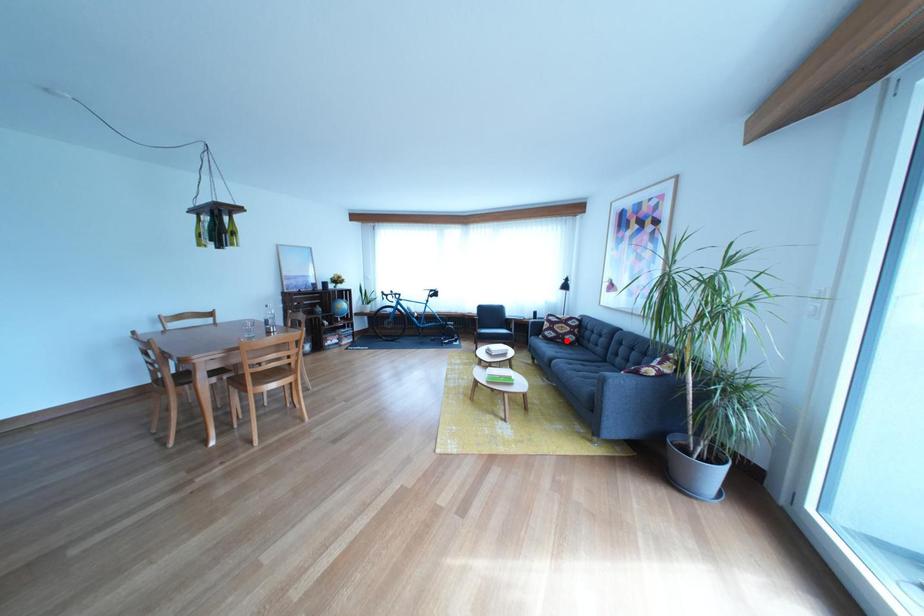
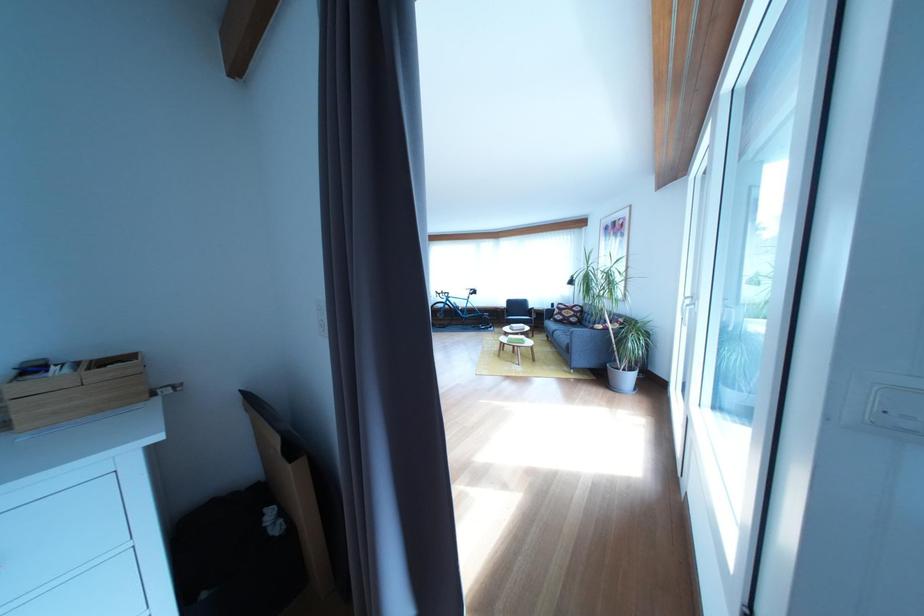
The point at the highlighted location is marked in the first image. Where is the corresponding point in the second image?

(575, 323)